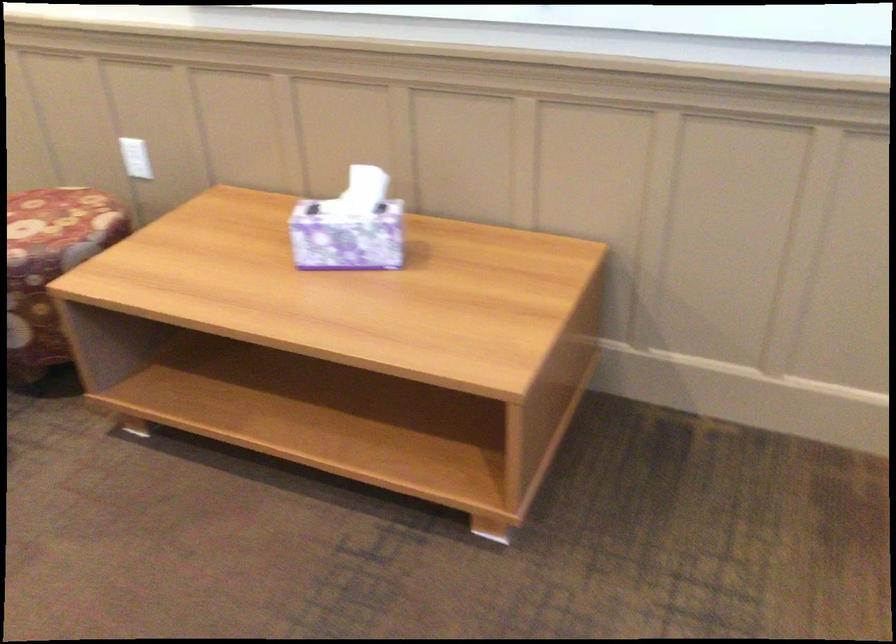
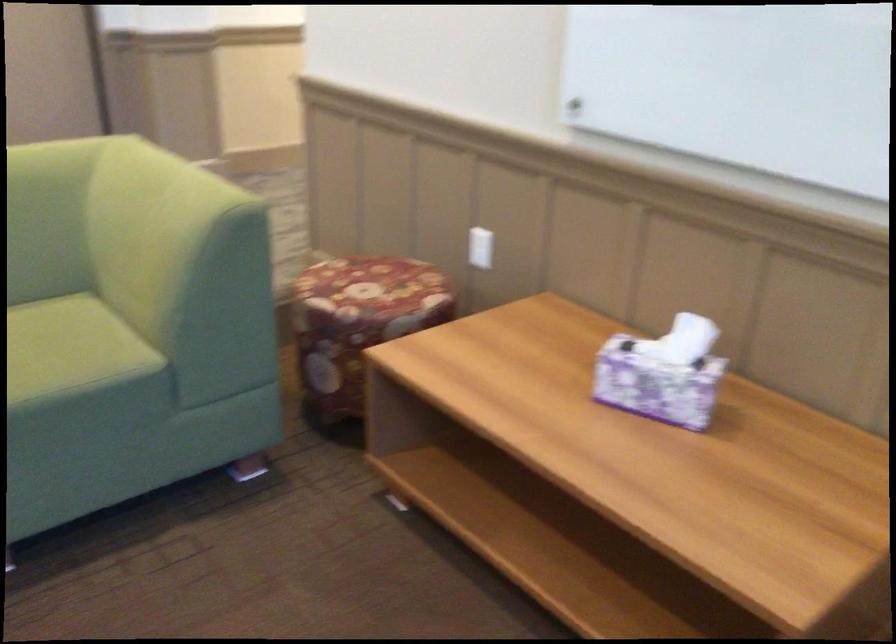
Question: The images are taken continuously from a first-person perspective. In which direction is your viewpoint rotating?

Choices:
 (A) Left
 (B) Right
 (C) Up
 (D) Down

Answer: (A)